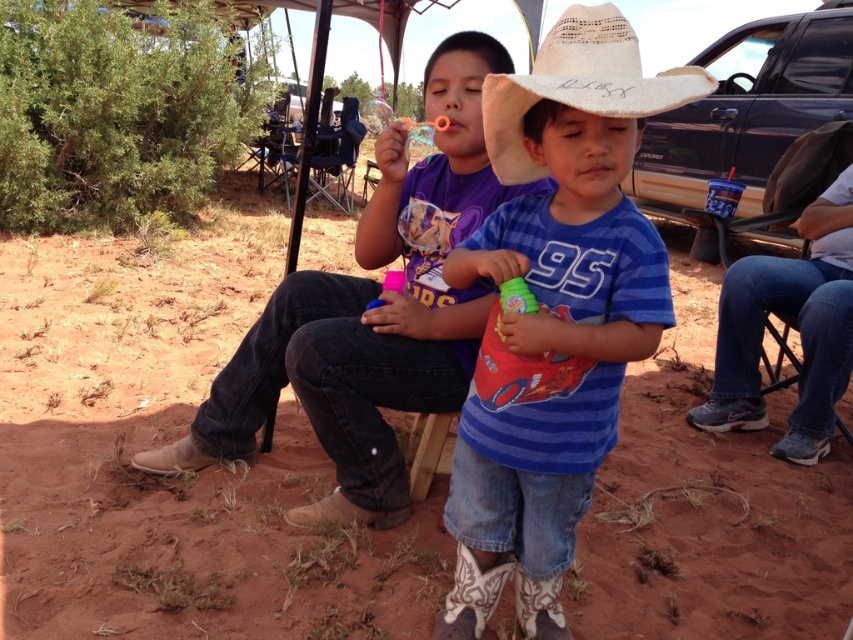
Question: Which point appears farthest from the camera in this image?

Choices:
 (A) (572, 45)
 (B) (572, 364)

Answer: (B)

Question: Which of the following is the farthest from the observer?

Choices:
 (A) dirt field at lower center
 (B) blue striped shirt at center
 (C) straw hat at center
 (D) denim jeans at center

Answer: (D)

Question: Is dirt field at lower center above blue striped shirt at center?

Choices:
 (A) no
 (B) yes

Answer: (A)

Question: Which of these objects is positioned closest to the dirt field at lower center?

Choices:
 (A) straw hat at center
 (B) denim jeans at center
 (C) blue striped shirt at center

Answer: (B)

Question: Can you confirm if blue striped shirt at center is positioned above denim jeans at center?

Choices:
 (A) no
 (B) yes

Answer: (A)

Question: Can you confirm if blue striped shirt at center is wider than straw hat at center?

Choices:
 (A) no
 (B) yes

Answer: (B)